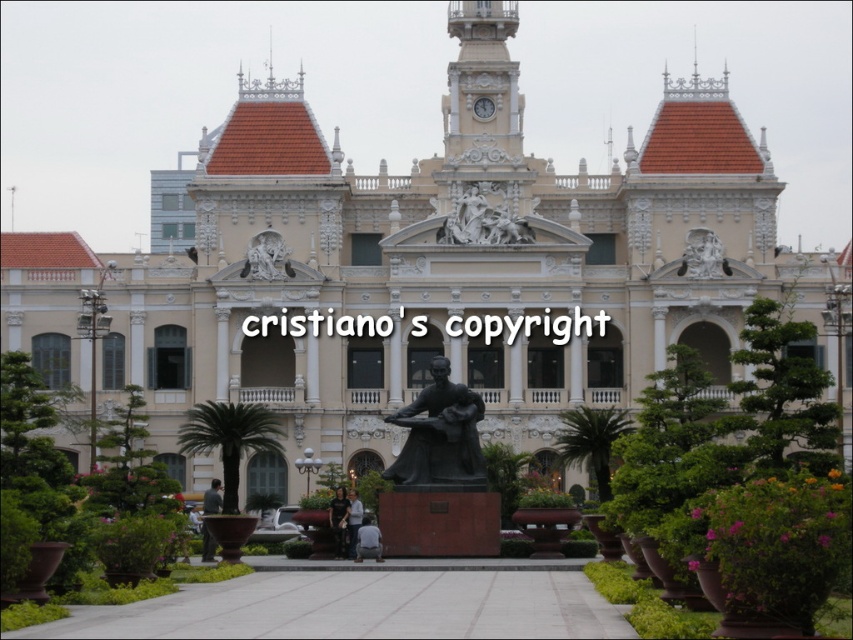
Question: Can you confirm if white marble statue at upper center is positioned below matte white clock at upper center?

Choices:
 (A) yes
 (B) no

Answer: (A)

Question: Which point is closer to the camera?

Choices:
 (A) matte white clock at upper center
 (B) white marble sculpture at center
 (C) white stone clock tower at upper center
 (D) bronze statue at center

Answer: (D)

Question: Which of the following is the closest to the observer?

Choices:
 (A) (505, 12)
 (B) (445, 227)

Answer: (B)

Question: Can you confirm if white stone clock tower at upper center is bigger than matte white clock at upper center?

Choices:
 (A) no
 (B) yes

Answer: (B)

Question: Is white stone clock tower at upper center bigger than bronze statue at center?

Choices:
 (A) yes
 (B) no

Answer: (B)

Question: Which object is farther from the camera taking this photo?

Choices:
 (A) matte white clock at upper center
 (B) bronze statue at center

Answer: (A)